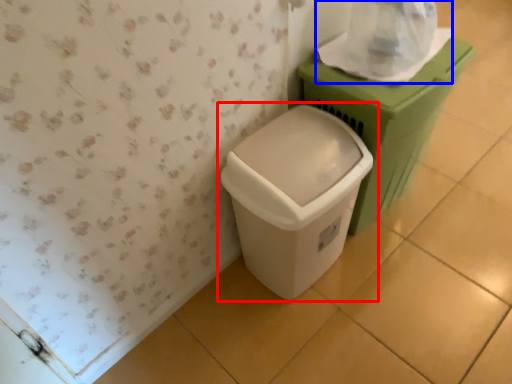
Question: Which object appears closest to the camera in this image, waste container (highlighted by a red box) or toilet paper (highlighted by a blue box)?

Choices:
 (A) waste container
 (B) toilet paper

Answer: (A)